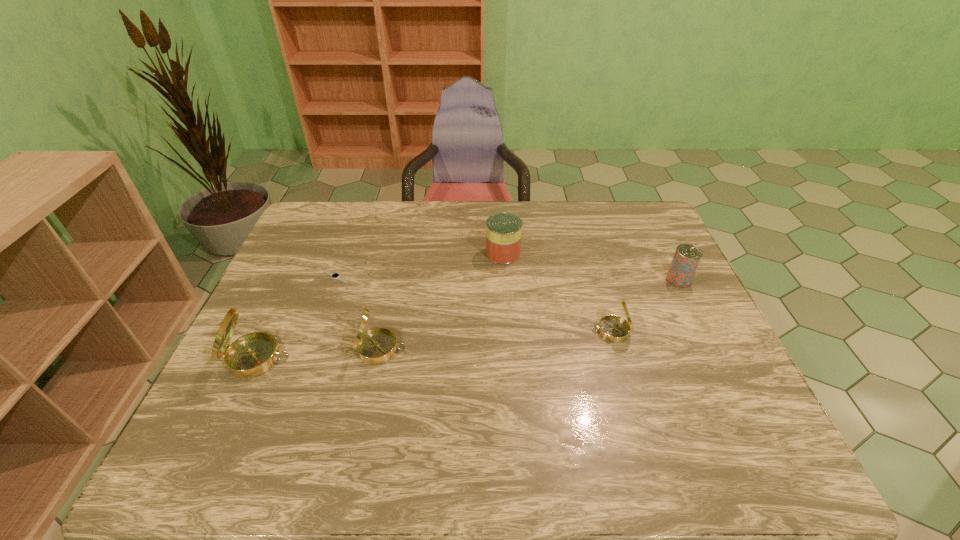
Select which compass appears as the closest to the shortest object. Please provide its 2D coordinates. Your answer should be formatted as a tuple, i.e. [(x, y)], where the tuple contains the x and y coordinates of a point satisfying the conditions above.

[(377, 345)]

The height and width of the screenshot is (540, 960). In order to click on compass that stands as the closest to the second compass from left to right in this screenshot , I will do `click(253, 354)`.